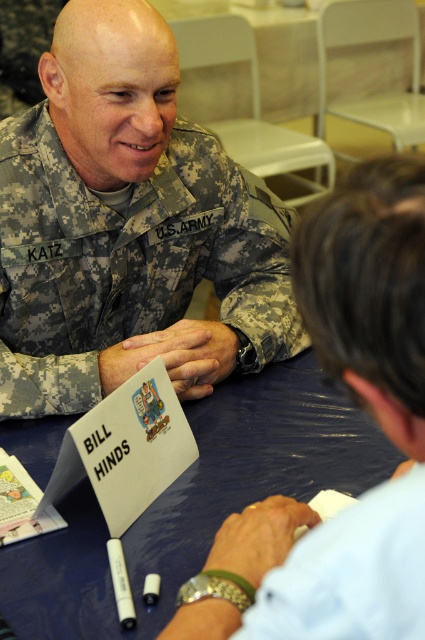
You are a tailor who needs to determine which fabric item requires more material to cover it. Based on the scene, which item is larger in size between the camouflage fabric us army uniform at center and the blue fabric table at center?

The camouflage fabric us army uniform at center has a larger size compared to the blue fabric table at center, so it requires more material to cover it.

You are a photographer at the event and need to position yourself so that both the camouflage fabric us army uniform at center and the blue fabric table at center are visible in your shot. Based on their positions, which object should be closer to the camera to ensure both are in frame?

The camouflage fabric us army uniform at center should be closer to the camera because the blue fabric table at center is behind it, so positioning the camera to focus on the uniform will naturally include the table in the background.